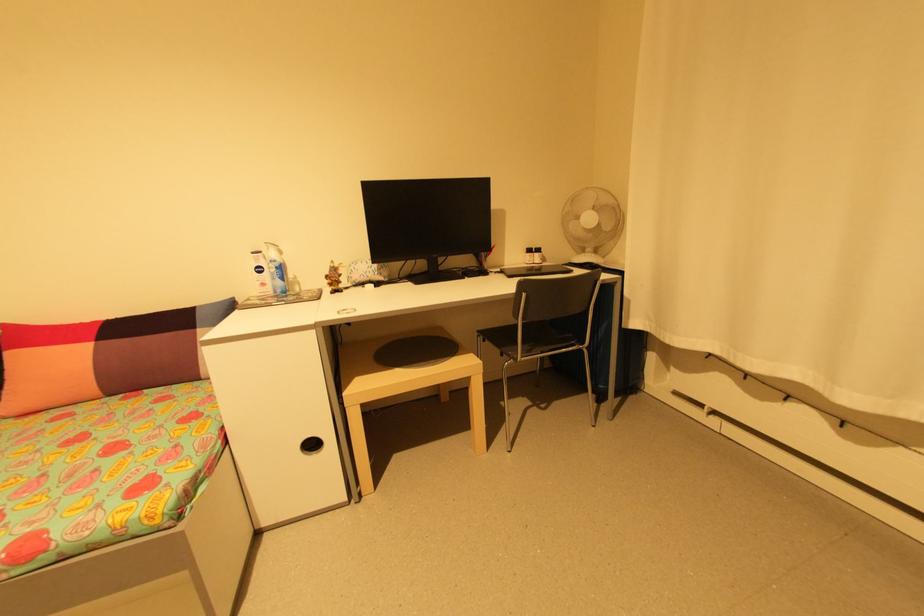
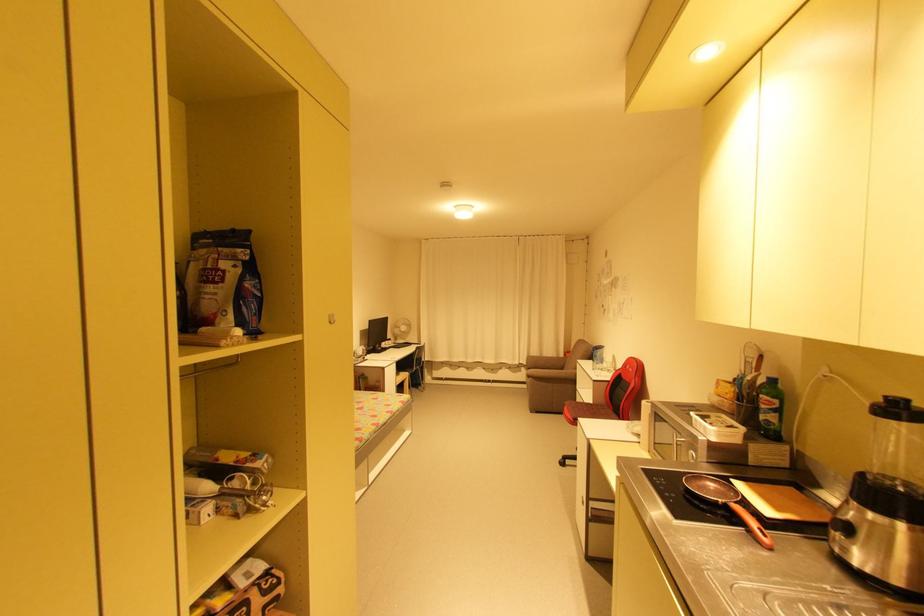
Find the pixel in the second image that matches [541,254] in the first image.

(395, 342)